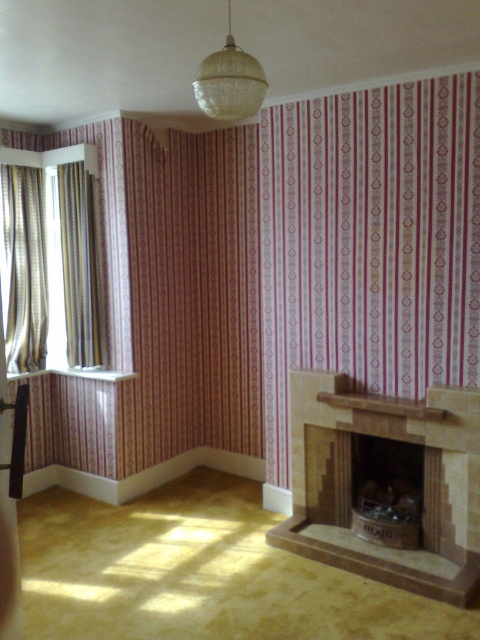
Question: Does silky gold curtains at left appear over translucent glass chandelier at upper center?

Choices:
 (A) yes
 (B) no

Answer: (B)

Question: Which object is farther from the camera taking this photo?

Choices:
 (A) gold-patterned curtains at left
 (B) translucent glass chandelier at upper center
 (C) silky gold curtains at left
 (D) striped fabric curtain at left

Answer: (D)

Question: Estimate the real-world distances between objects in this image. Which object is farther from the translucent glass chandelier at upper center?

Choices:
 (A) striped fabric curtain at left
 (B) brown stone fireplace at lower right
 (C) gold-patterned curtains at left
 (D) pink striped curtain at upper left

Answer: (B)

Question: Which of the following is the closest to the observer?

Choices:
 (A) striped fabric curtain at left
 (B) translucent glass chandelier at upper center
 (C) gold-patterned curtains at left

Answer: (B)

Question: Can you confirm if silky gold curtains at left is positioned to the right of translucent glass chandelier at upper center?

Choices:
 (A) no
 (B) yes

Answer: (A)

Question: Considering the relative positions of striped fabric curtain at left and translucent glass chandelier at upper center in the image provided, where is striped fabric curtain at left located with respect to translucent glass chandelier at upper center?

Choices:
 (A) below
 (B) above

Answer: (A)